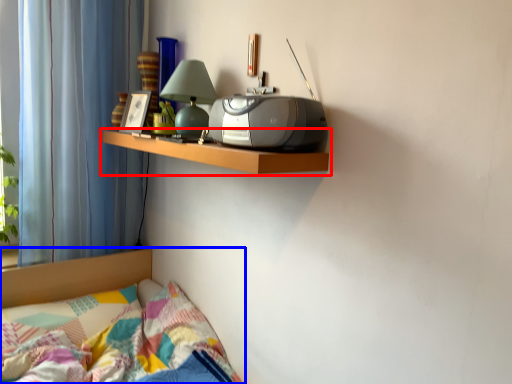
Question: Among these objects, which one is nearest to the camera, shelf (highlighted by a red box) or bed (highlighted by a blue box)?

Choices:
 (A) shelf
 (B) bed

Answer: (A)